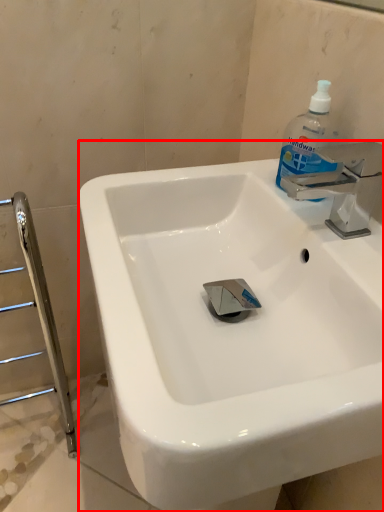
Question: Where is sink (annotated by the red box) located in relation to cleaning product in the image?

Choices:
 (A) left
 (B) right

Answer: (A)